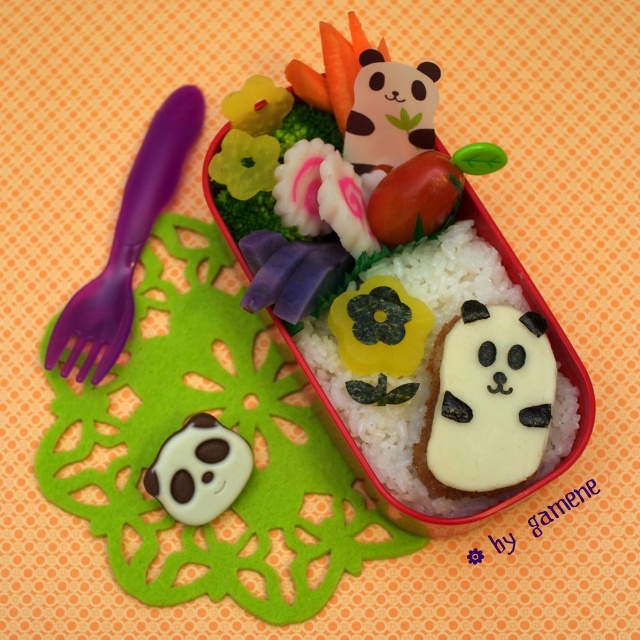
You are a food critic analyzing the bento box and want to describe the location of the white rice at center. What are its coordinates?

The white rice at center is located at coordinates point (380, 424).

You are a food critic who needs to take a photo of the bento box. The purple plastic fork at left is located at point (x=128, y=243). Where should you position your camera to ensure the fork is centered in the photo?

To center the purple plastic fork at left in the photo, position the camera so that the fork is at the center point of the image, which would be at coordinates 0.5, 0.5. Since the fork is at (x=128, y=243), you need to adjust the camera position to move the fork closer to the center coordinates.

Looking at the bento box, you notice two white items at the center of the white rice at center and white cheese at center. Which of these two items is taller?

The white rice at center is taller than the white cheese at center.